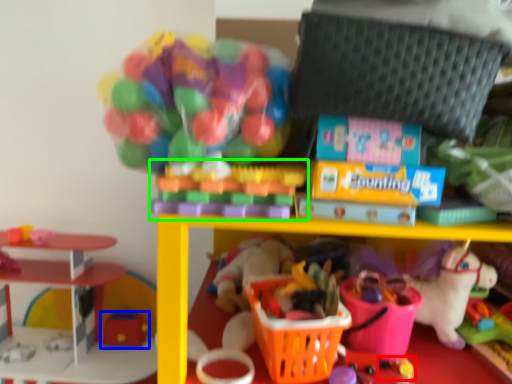
Question: Which object is the farthest from toy (highlighted by a red box)? Choose among these: toy (highlighted by a blue box) or toy (highlighted by a green box).

Choices:
 (A) toy
 (B) toy

Answer: (A)